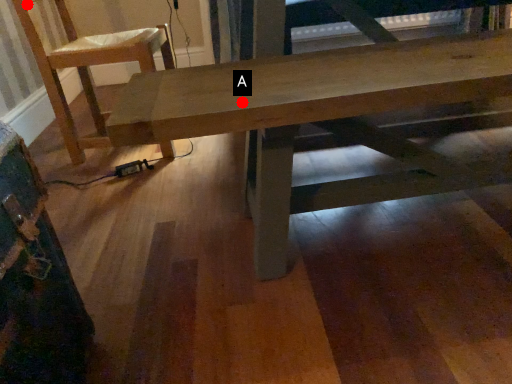
Question: Two points are circled on the image, labeled by A and B beside each circle. Which point is further to the camera?

Choices:
 (A) A is further
 (B) B is further

Answer: (B)